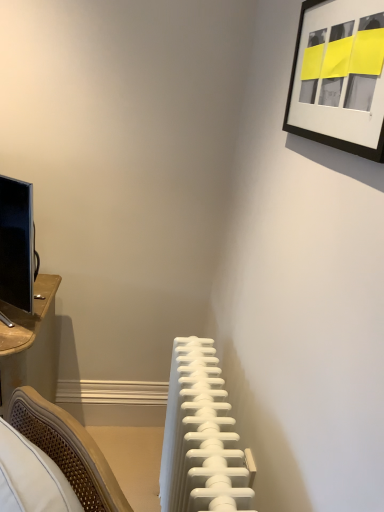
Locate an element on the screen. The width and height of the screenshot is (384, 512). white plastic radiator at center is located at coordinates (201, 437).

Image resolution: width=384 pixels, height=512 pixels. Describe the element at coordinates (201, 437) in the screenshot. I see `white plastic radiator at center` at that location.

What do you see at coordinates (339, 77) in the screenshot?
I see `black matte picture frame at upper right` at bounding box center [339, 77].

Find the location of a particular element. The image size is (384, 512). black matte picture frame at upper right is located at coordinates (339, 77).

Find the location of a particular element. white plastic radiator at center is located at coordinates (201, 437).

Between black matte picture frame at upper right and white plastic radiator at center, which one appears on the right side from the viewer's perspective?

Positioned to the right is black matte picture frame at upper right.

Considering their positions, is black matte picture frame at upper right located in front of or behind white plastic radiator at center?

black matte picture frame at upper right is in front of white plastic radiator at center.

Considering the points (319, 34) and (194, 438), which point is in front, point (319, 34) or point (194, 438)?

The point (319, 34) is more forward.

From the image's perspective, does black matte picture frame at upper right appear lower than white plastic radiator at center?

Incorrect, from the image's perspective, black matte picture frame at upper right is higher than white plastic radiator at center.

Looking at this image, from a real-world perspective, is black matte picture frame at upper right physically above white plastic radiator at center?

Yes, from a real-world perspective, black matte picture frame at upper right is over white plastic radiator at center

Which of these two, black matte picture frame at upper right or white plastic radiator at center, is thinner?

With smaller width is black matte picture frame at upper right.

From their relative heights in the image, would you say black matte picture frame at upper right is taller or shorter than white plastic radiator at center?

black matte picture frame at upper right is shorter than white plastic radiator at center.

Looking at the image, does black matte picture frame at upper right seem bigger or smaller compared to white plastic radiator at center?

Clearly, black matte picture frame at upper right is smaller in size than white plastic radiator at center.

Is black matte picture frame at upper right not inside white plastic radiator at center?

That's correct, black matte picture frame at upper right is outside of white plastic radiator at center.

Would you consider black matte picture frame at upper right to be distant from white plastic radiator at center?

Actually, black matte picture frame at upper right and white plastic radiator at center are a little close together.

Is black matte picture frame at upper right aimed at white plastic radiator at center?

No, black matte picture frame at upper right is not facing towards white plastic radiator at center.

What's the angular difference between black matte picture frame at upper right and white plastic radiator at center's facing directions?

There is a 0.164-degree angle between the facing directions of black matte picture frame at upper right and white plastic radiator at center.

Find the location of `picture frame that is above the white plastic radiator at center (from the image's perspective)`. picture frame that is above the white plastic radiator at center (from the image's perspective) is located at coordinates (339, 77).

Considering the positions of objects white plastic radiator at center and black matte picture frame at upper right in the image provided, who is more to the left, white plastic radiator at center or black matte picture frame at upper right?

white plastic radiator at center is more to the left.

Relative to black matte picture frame at upper right, is white plastic radiator at center in front or behind?

white plastic radiator at center is positioned farther from the viewer than black matte picture frame at upper right.

Is point (199, 411) in front of point (382, 13)?

No, (199, 411) is behind (382, 13).

From the image's perspective, is white plastic radiator at center over black matte picture frame at upper right?

No, from the image's perspective, white plastic radiator at center is not over black matte picture frame at upper right.

From a real-world perspective, is white plastic radiator at center physically located above or below black matte picture frame at upper right?

In terms of real-world spatial position, white plastic radiator at center is below black matte picture frame at upper right.

In the scene shown: Can you confirm if white plastic radiator at center is thinner than black matte picture frame at upper right?

Incorrect, the width of white plastic radiator at center is not less than that of black matte picture frame at upper right.

Who is shorter, white plastic radiator at center or black matte picture frame at upper right?

black matte picture frame at upper right is shorter.

Does white plastic radiator at center have a smaller size compared to black matte picture frame at upper right?

Actually, white plastic radiator at center might be larger than black matte picture frame at upper right.

Would you say black matte picture frame at upper right is part of white plastic radiator at center's contents?

That's incorrect, black matte picture frame at upper right is not inside white plastic radiator at center.

Are white plastic radiator at center and black matte picture frame at upper right far apart?

No.

Could you tell me if white plastic radiator at center is turned towards black matte picture frame at upper right?

No.

I want to click on picture frame above the white plastic radiator at center (from a real-world perspective), so click(x=339, y=77).

You are a GUI agent. You are given a task and a screenshot of the screen. Output one action in this format:
    pyautogui.click(x=<x>, y=<y>)
    Task: Click on the radiator behind the black matte picture frame at upper right
    The height and width of the screenshot is (512, 384).
    Given the screenshot: What is the action you would take?
    pyautogui.click(x=201, y=437)

Find the location of a particular element. The width and height of the screenshot is (384, 512). picture frame that appears above the white plastic radiator at center (from a real-world perspective) is located at coordinates (339, 77).